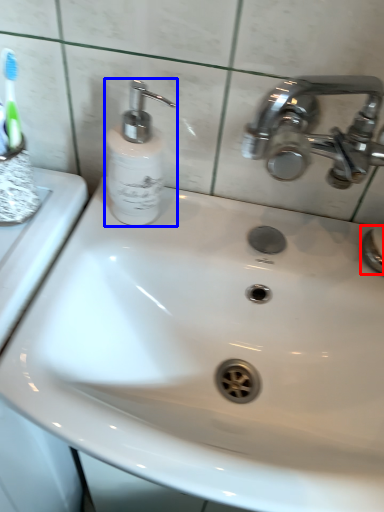
Question: Among these objects, which one is farthest to the camera, plumbing fixture (highlighted by a red box) or soap dispenser (highlighted by a blue box)?

Choices:
 (A) plumbing fixture
 (B) soap dispenser

Answer: (A)